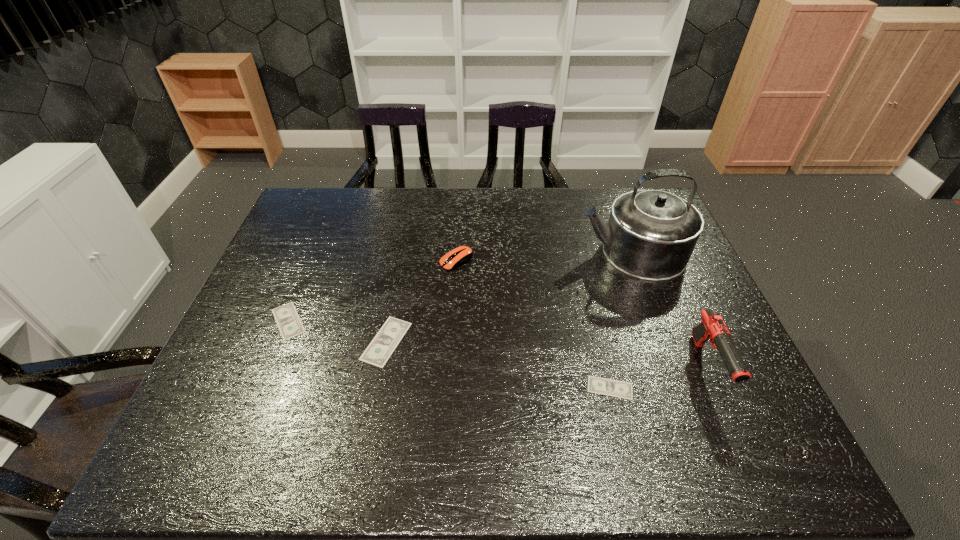
Locate an element on the screen. The width and height of the screenshot is (960, 540). vacant space at the near left corner is located at coordinates (252, 396).

Find the location of a particular element. free space between the fifth shortest object and the third object from left to right is located at coordinates tap(582, 314).

Find the location of a particular element. free space between the third tallest object and the gun is located at coordinates (582, 314).

The width and height of the screenshot is (960, 540). I want to click on blank region between the computer mouse and the leftmost object, so click(x=372, y=291).

This screenshot has height=540, width=960. I want to click on vacant space that's between the tallest object and the second money from left to right, so [x=509, y=297].

Find the location of a particular element. This screenshot has width=960, height=540. vacant point located between the third tallest object and the shortest object is located at coordinates pyautogui.click(x=533, y=325).

Find the location of `free spot between the fifth object from right to left and the shortest money`. free spot between the fifth object from right to left and the shortest money is located at coordinates (498, 364).

You are a GUI agent. You are given a task and a screenshot of the screen. Output one action in this format:
    pyautogui.click(x=<x>, y=<y>)
    Task: Click on the free area in between the rightmost money and the fifth shortest object
    The image size is (960, 540).
    Given the screenshot: What is the action you would take?
    pyautogui.click(x=659, y=377)

Find the location of `blank region between the gun and the computer mouse`. blank region between the gun and the computer mouse is located at coordinates (582, 314).

Image resolution: width=960 pixels, height=540 pixels. Identify the location of free space between the computer mouse and the second object from left to right. (421, 301).